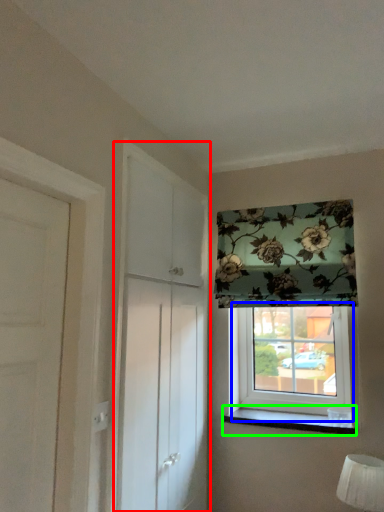
Question: Considering the real-world distances, which object is closest to screen door (highlighted by a red box)? window (highlighted by a blue box) or window sill (highlighted by a green box).

Choices:
 (A) window
 (B) window sill

Answer: (A)